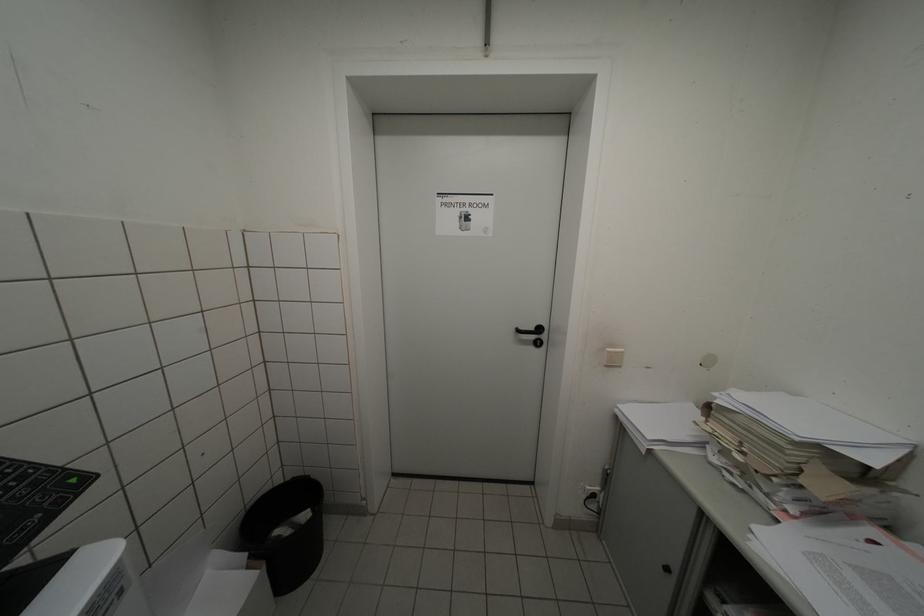
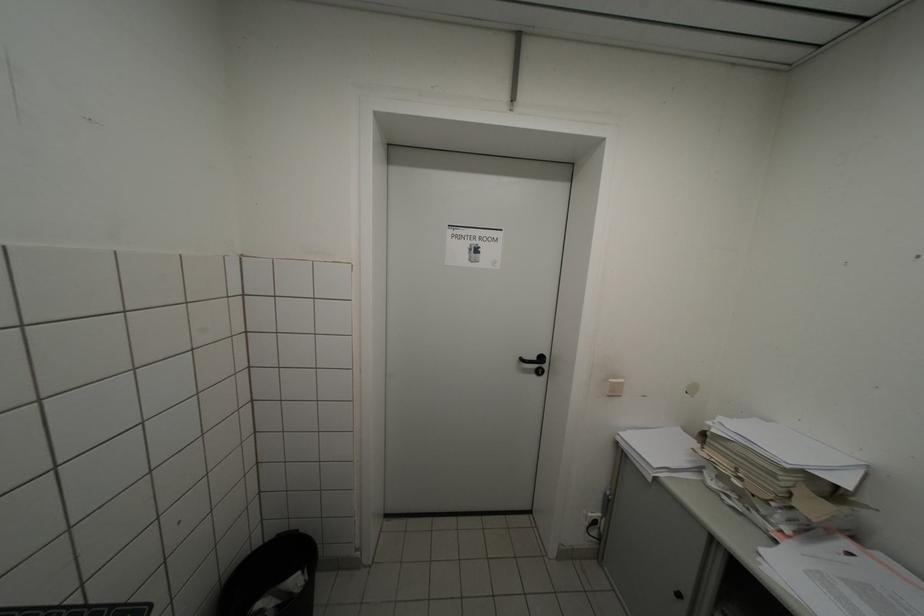
Locate, in the second image, the point that corresponds to (318,479) in the first image.

(306, 533)